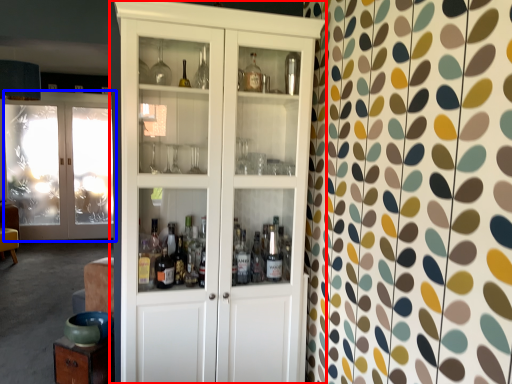
Question: Which object is closer to the camera taking this photo, cupboard (highlighted by a red box) or door (highlighted by a blue box)?

Choices:
 (A) cupboard
 (B) door

Answer: (A)